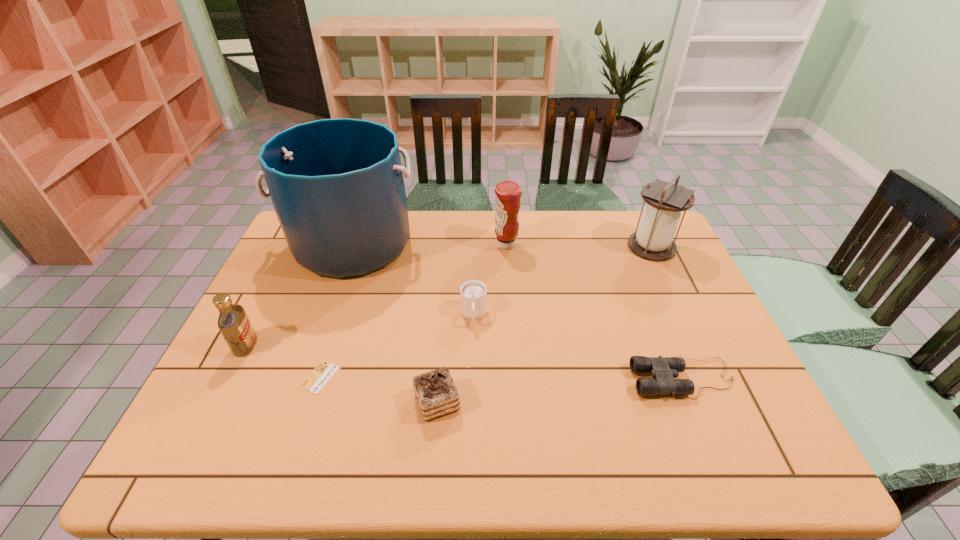
Identify the location of free location located 0.220m on the left of the lantern. The width and height of the screenshot is (960, 540). (560, 247).

At what (x,y) coordinates should I click in order to perform the action: click on vacant space located 0.200m on the right of the third object from right to left. Please return your answer as a coordinate pair (x, y). Image resolution: width=960 pixels, height=540 pixels. Looking at the image, I should click on (578, 245).

The height and width of the screenshot is (540, 960). I want to click on vacant region located 0.160m on the front-facing side of the fifth shortest object, so click(317, 346).

Identify the location of free space located on the side with the handle of the fourth farthest object. (472, 436).

The width and height of the screenshot is (960, 540). I want to click on free spot located on the left of the chocolate cake, so click(x=311, y=402).

Where is `vacant region located at the eyepiece of the seventh tallest object`? This screenshot has height=540, width=960. vacant region located at the eyepiece of the seventh tallest object is located at coordinates (604, 379).

The height and width of the screenshot is (540, 960). In order to click on vacant space located at the eyepiece of the seventh tallest object in this screenshot , I will do tap(612, 379).

Where is `free space located 0.280m at the eyepiece of the seventh tallest object`? free space located 0.280m at the eyepiece of the seventh tallest object is located at coordinates (517, 379).

Locate an element on the screen. free region located 0.200m on the right of the identity card is located at coordinates (420, 377).

Locate an element on the screen. The height and width of the screenshot is (540, 960). bucket positioned at the far edge is located at coordinates (337, 187).